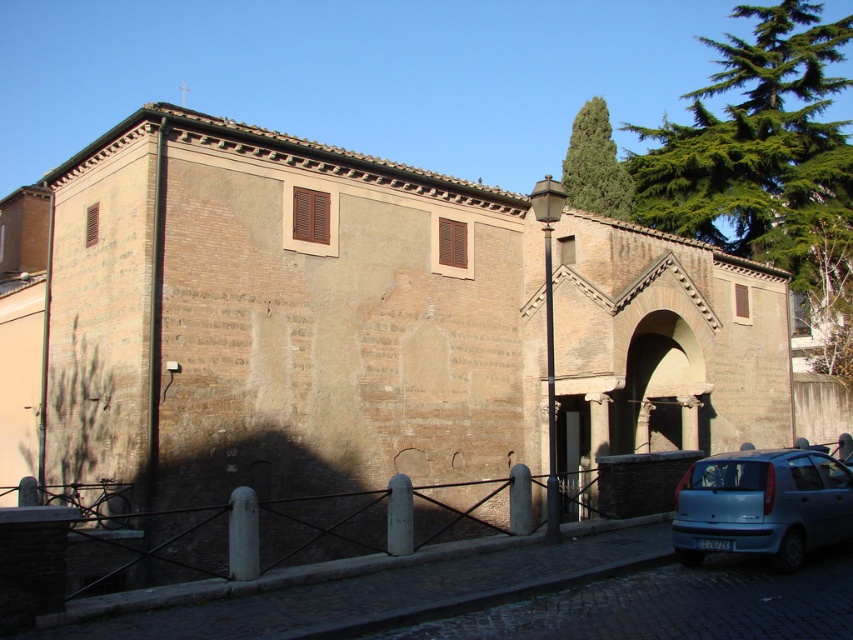
Based on the photo, can you confirm if green needle-like leaves at upper right is smaller than green leafy tree at upper center?

No, green needle-like leaves at upper right is not smaller than green leafy tree at upper center.

Which is behind, point (767, 209) or point (585, 156)?

The point (767, 209) is behind.

The image size is (853, 640). Describe the element at coordinates (764, 163) in the screenshot. I see `green needle-like leaves at upper right` at that location.

Image resolution: width=853 pixels, height=640 pixels. In order to click on green needle-like leaves at upper right in this screenshot , I will do `click(764, 163)`.

Can you confirm if smooth stone archway at center is positioned below whiteplasticlicense plate at lower center?

Actually, smooth stone archway at center is above whiteplasticlicense plate at lower center.

Who is positioned more to the left, smooth stone archway at center or whiteplasticlicense plate at lower center?

whiteplasticlicense plate at lower center is more to the left.

Identify the location of smooth stone archway at center. Image resolution: width=853 pixels, height=640 pixels. (663, 388).

Looking at this image, between green needle-like leaves at upper right and smooth stone archway at center, which one has more height?

green needle-like leaves at upper right is taller.

Describe the element at coordinates (764, 163) in the screenshot. This screenshot has height=640, width=853. I see `green needle-like leaves at upper right` at that location.

Is point (814, 6) positioned in front of point (688, 440)?

No, it is not.

The width and height of the screenshot is (853, 640). I want to click on green needle-like leaves at upper right, so click(764, 163).